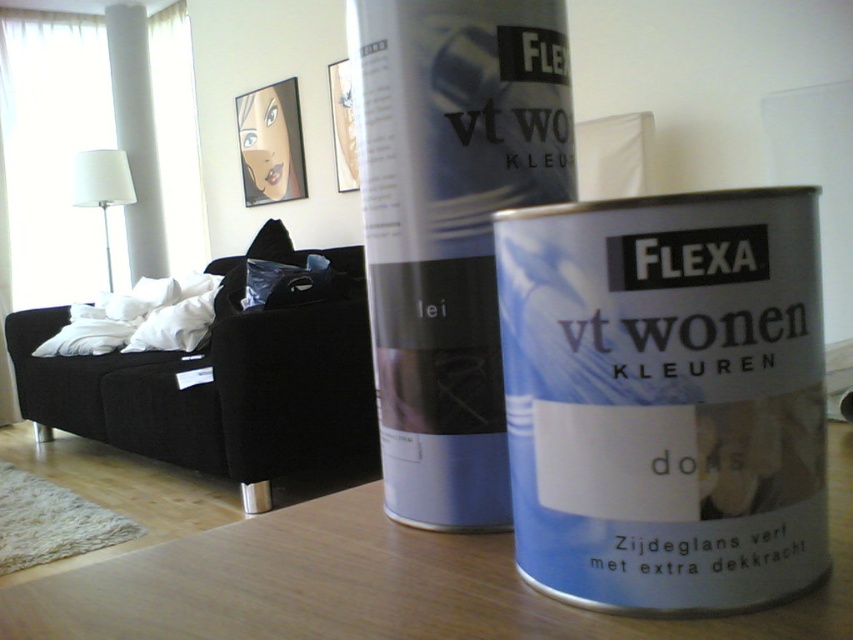
Question: Does wooden table at center have a smaller size compared to black fabric couch at left?

Choices:
 (A) no
 (B) yes

Answer: (B)

Question: Which of the following is the farthest from the observer?

Choices:
 (A) (329, 524)
 (B) (80, 420)
 (C) (706, 220)

Answer: (B)

Question: Among these objects, which one is nearest to the camera?

Choices:
 (A) wooden table at center
 (B) black fabric couch at left

Answer: (A)

Question: Which of the following is the farthest from the observer?

Choices:
 (A) white fabric lampshade at upper left
 (B) black fabric couch at left
 (C) satin white paint can at center
 (D) wooden table at center

Answer: (A)

Question: Does wooden table at center have a lesser width compared to white fabric lampshade at upper left?

Choices:
 (A) no
 (B) yes

Answer: (A)

Question: Does matte silver paint can at center appear on the right side of black fabric couch at left?

Choices:
 (A) no
 (B) yes

Answer: (B)